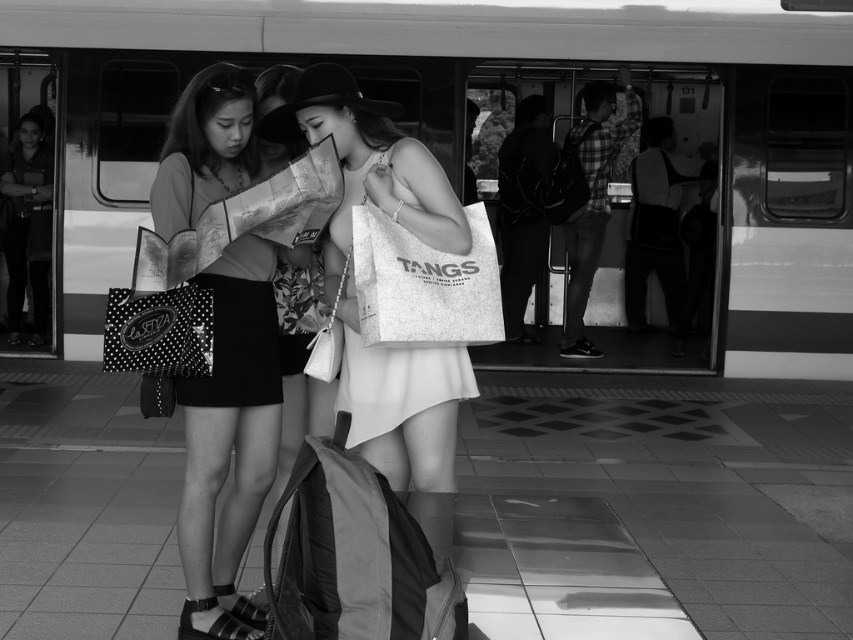
Question: Based on their relative distances, which object is nearer to the white fabric bag at center?

Choices:
 (A) white paper bag at center
 (B) matte black skirt at center

Answer: (A)

Question: Is metallic silver train at center to the left of polka dot fabric shopping bag at left from the viewer's perspective?

Choices:
 (A) no
 (B) yes

Answer: (A)

Question: Is white fabric bag at center wider than leather backpack at center?

Choices:
 (A) yes
 (B) no

Answer: (A)

Question: Which of the following is the farthest from the observer?

Choices:
 (A) (138, 244)
 (B) (434, 451)
 (C) (451, 273)

Answer: (B)

Question: Among these points, which one is nearest to the camera?

Choices:
 (A) (310, 561)
 (B) (392, 269)
 (C) (688, 348)
 (D) (160, 342)

Answer: (A)

Question: Is matte black skirt at center wider than leather backpack at center?

Choices:
 (A) no
 (B) yes

Answer: (A)